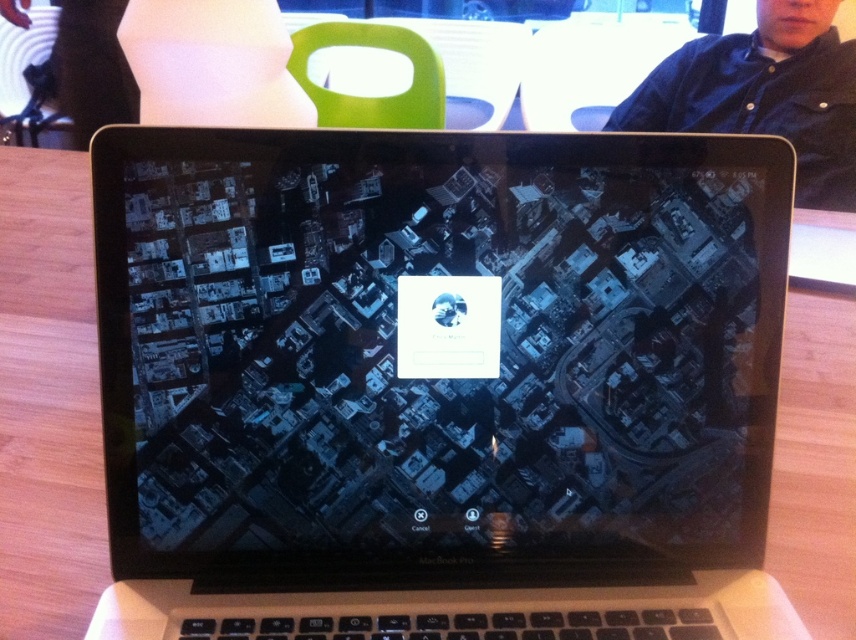
You are trying to locate the sleek silver laptop at center in the image. What are the coordinates where it is positioned?

The sleek silver laptop at center is positioned at coordinates point (438, 384).

You are organizing items on a desk and need to place the sleek silver laptop at center and the dark blue shirt at upper right. Given their sizes, which item should you place first to ensure both fit properly?

The sleek silver laptop at center is smaller than the dark blue shirt at upper right, so you should place the dark blue shirt at upper right first to accommodate its larger size before placing the smaller laptop.

You are trying to place a new accessory on the wooden table where the sleek silver laptop at center and dark blue shirt at upper right are located. If you want to place it to the right of the laptop but to the left of the shirt, is there enough space between them?

The sleek silver laptop at center is positioned on the left side of dark blue shirt at upper right, so there is space between them. You can place the accessory to the right of the laptop but to the left of the shirt.